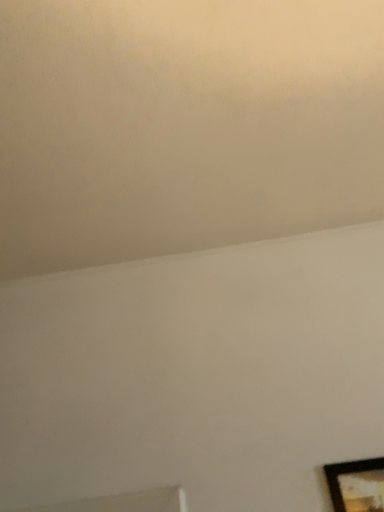
What do you see at coordinates (356, 485) in the screenshot?
I see `black matte picture frame at lower right` at bounding box center [356, 485].

Where is `black matte picture frame at lower right`? The image size is (384, 512). black matte picture frame at lower right is located at coordinates (356, 485).

Locate an element on the screen. This screenshot has height=512, width=384. black matte picture frame at lower right is located at coordinates (356, 485).